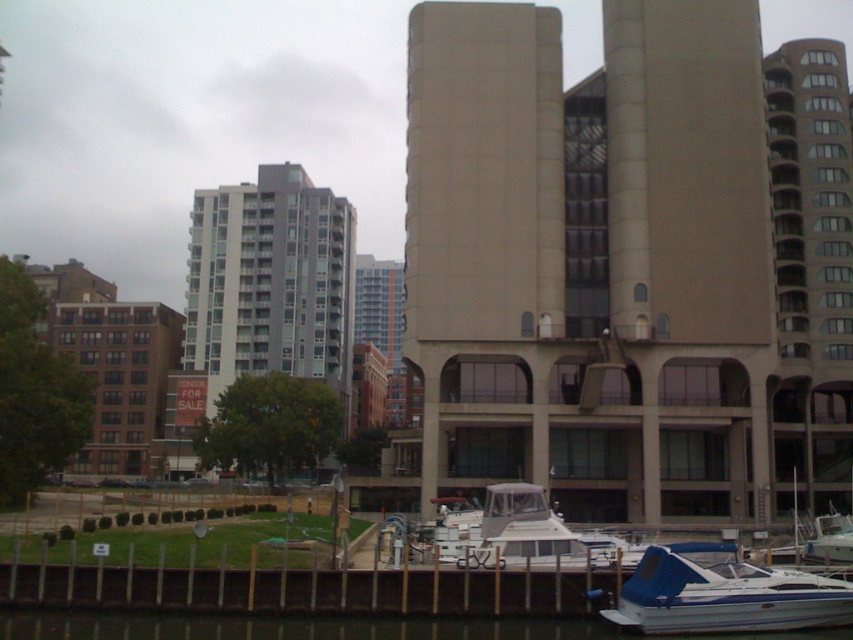
Is point (631, 620) in front of point (531, 508)?

Yes, point (631, 620) is closer to viewer.

Looking at this image, is blue vinyl boat at lower right bigger than white matte boat at center?

No.

This screenshot has height=640, width=853. What are the coordinates of `blue vinyl boat at lower right` in the screenshot? It's located at (723, 593).